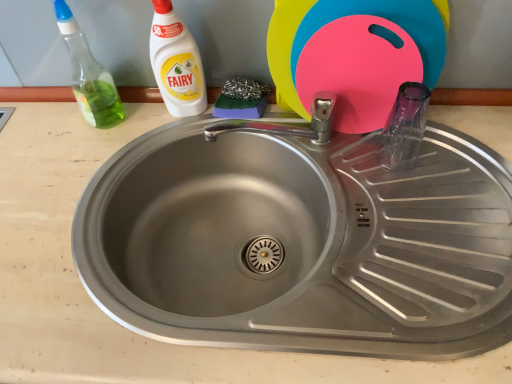
The height and width of the screenshot is (384, 512). In order to click on empty space that is to the right of green translucent spray bottle at left, marked as the second cleaning product in a right-to-left arrangement in this screenshot , I will do `click(157, 123)`.